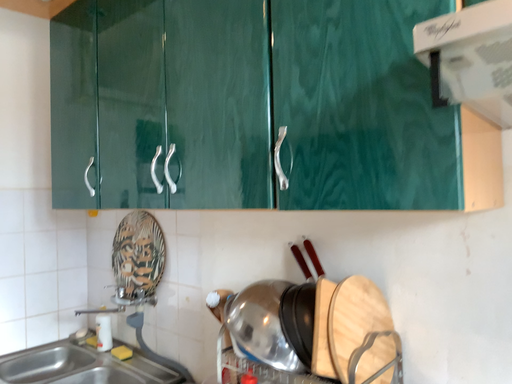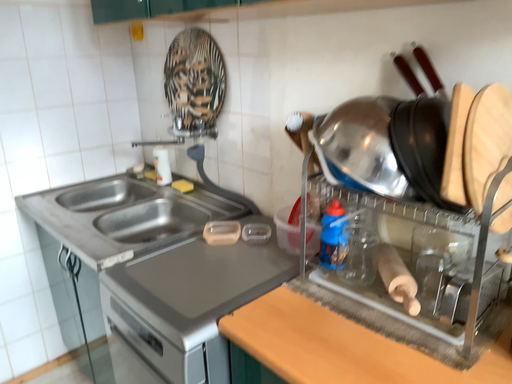
Question: Which way did the camera rotate in the video?

Choices:
 (A) rotated upward
 (B) rotated downward

Answer: (B)